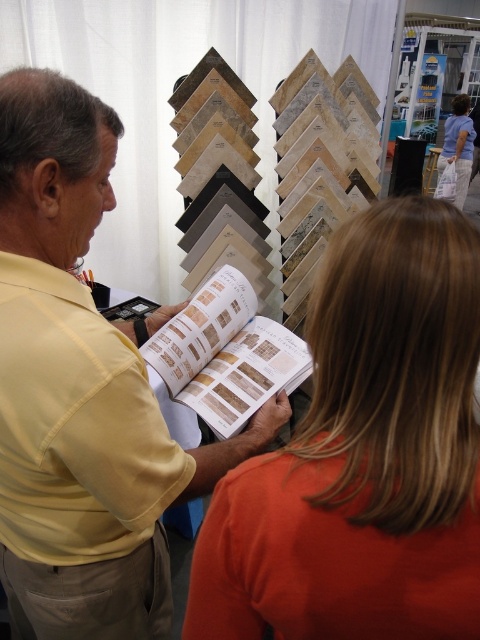
Can you confirm if wooden book at center is positioned to the right of orange fabric shirt at upper right?

In fact, wooden book at center is to the left of orange fabric shirt at upper right.

Is point (228, 314) less distant than point (437, 176)?

Yes, it is.

At what (x,y) coordinates should I click in order to perform the action: click on wooden book at center. Please return your answer as a coordinate pair (x, y). This screenshot has height=640, width=480. Looking at the image, I should click on (226, 355).

Does orange matte shirt at center have a greater width compared to orange fabric shirt at upper right?

Incorrect, orange matte shirt at center's width does not surpass orange fabric shirt at upper right's.

Which is in front, point (240, 545) or point (472, 147)?

Point (240, 545) is in front.

Identify the location of orange matte shirt at center. The width and height of the screenshot is (480, 640). (364, 454).

In the scene shown: Can you confirm if orange matte shirt at center is thinner than wooden book at center?

Indeed, orange matte shirt at center has a lesser width compared to wooden book at center.

Between orange matte shirt at center and wooden book at center, which one appears on the left side from the viewer's perspective?

From the viewer's perspective, wooden book at center appears more on the left side.

You are a GUI agent. You are given a task and a screenshot of the screen. Output one action in this format:
    pyautogui.click(x=<x>, y=<y>)
    Task: Click on the orange matte shirt at center
    
    Given the screenshot: What is the action you would take?
    click(x=364, y=454)

Where is `orange matte shirt at center`? The image size is (480, 640). orange matte shirt at center is located at coordinates (364, 454).